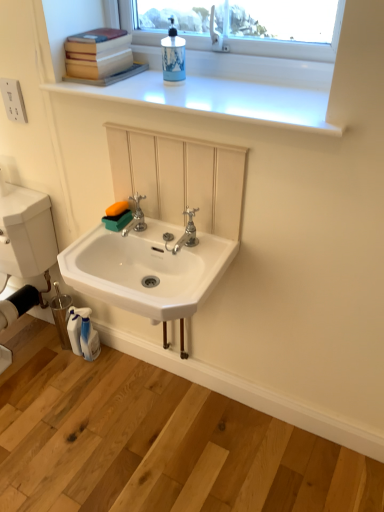
The width and height of the screenshot is (384, 512). What are the coordinates of `free point to the right of silver metallic faucet at center, marked as the 1th tap in a left-to-right arrangement` in the screenshot? It's located at 170,236.